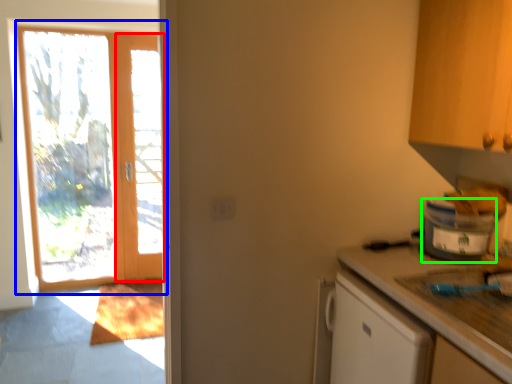
Question: Which object is the farthest from screen door (highlighted by a red box)? Choose among these: door (highlighted by a blue box) or appliance (highlighted by a green box).

Choices:
 (A) door
 (B) appliance

Answer: (B)